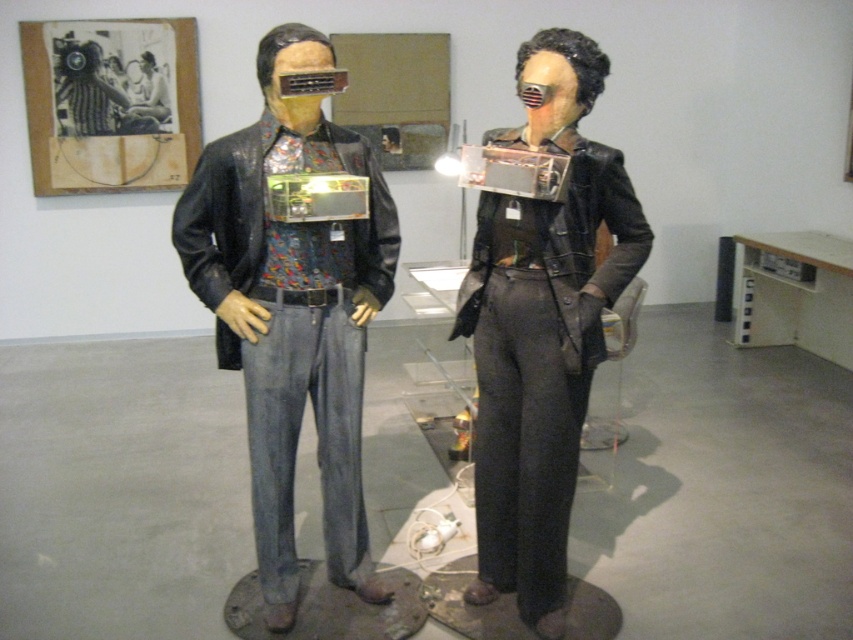
Image resolution: width=853 pixels, height=640 pixels. Describe the element at coordinates (293, 312) in the screenshot. I see `matte black leather jacket at center` at that location.

Which is below, matte black leather jacket at center or shiny black leather jacket at center?

shiny black leather jacket at center is lower down.

Locate an element on the screen. Image resolution: width=853 pixels, height=640 pixels. matte black leather jacket at center is located at coordinates (293, 312).